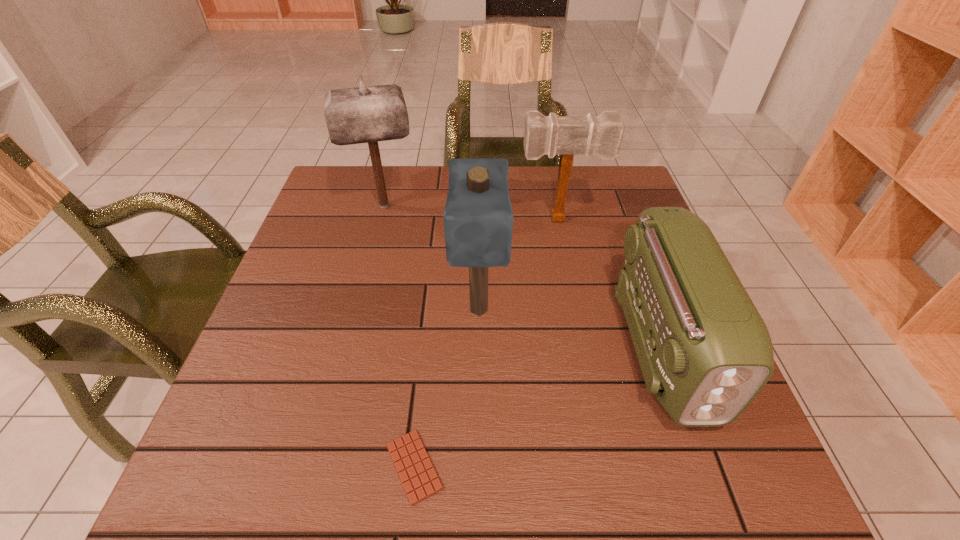
Locate an element on the screen. the leftmost mallet is located at coordinates (363, 114).

Identify the location of the nearest mallet. (478, 219).

Where is `the third shortest object`? the third shortest object is located at coordinates (601, 135).

Identify the location of the shortest mallet. The width and height of the screenshot is (960, 540). (601, 135).

Where is `the fourth tallest object`? The width and height of the screenshot is (960, 540). the fourth tallest object is located at coordinates (705, 352).

Where is `the shortest object`? the shortest object is located at coordinates (416, 472).

Where is `blank space located on the right of the leftmost mallet`? Image resolution: width=960 pixels, height=540 pixels. blank space located on the right of the leftmost mallet is located at coordinates (540, 206).

The width and height of the screenshot is (960, 540). Find the location of `vacant space located 0.210m on the left of the nearest mallet`. vacant space located 0.210m on the left of the nearest mallet is located at coordinates (356, 310).

Image resolution: width=960 pixels, height=540 pixels. Find the location of `free space located 0.260m on the front of the rightmost mallet`. free space located 0.260m on the front of the rightmost mallet is located at coordinates (576, 301).

What are the coordinates of `vacant point located on the front-facing side of the radio_receiver` in the screenshot? It's located at (704, 463).